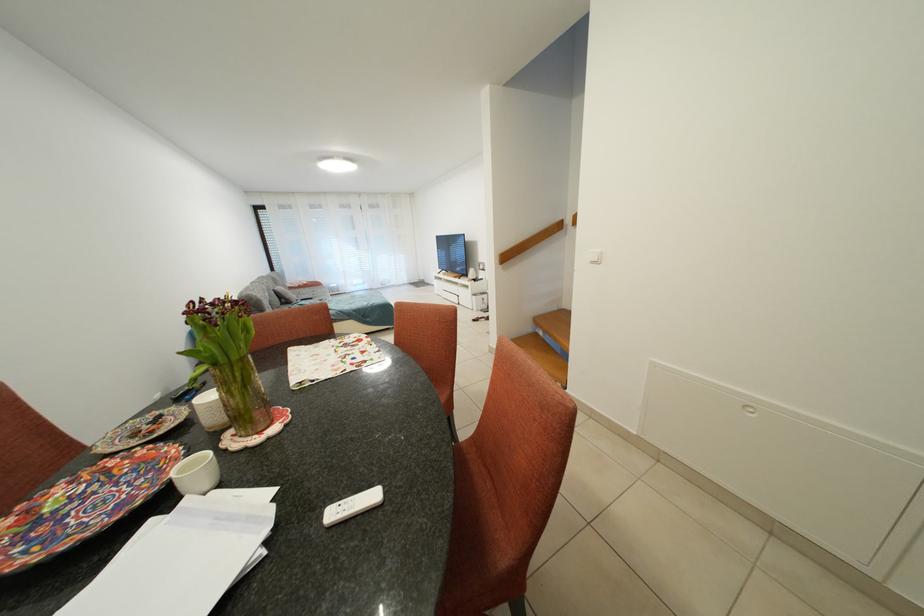
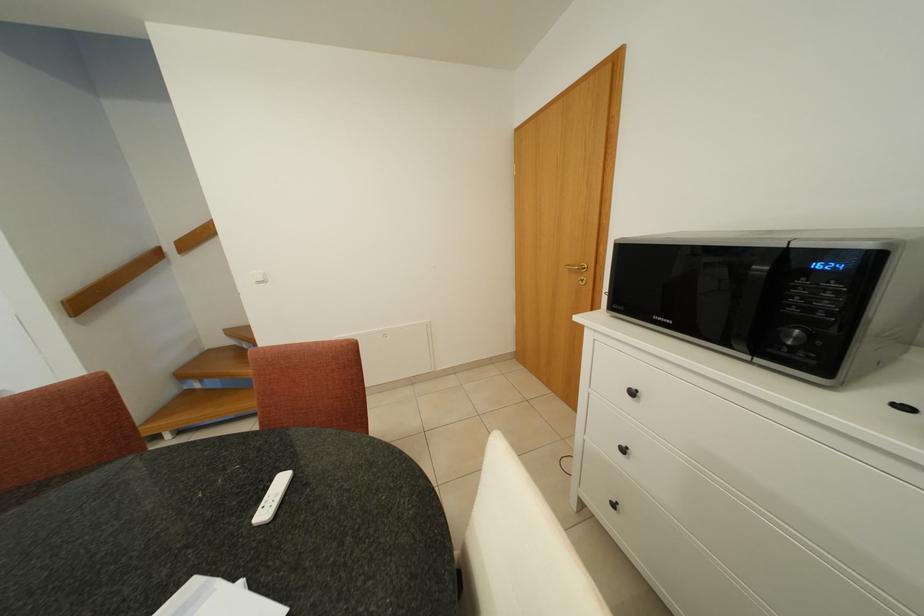
Question: The first image is from the beginning of the video and the second image is from the end. How did the camera likely rotate when shooting the video?

Choices:
 (A) Left
 (B) Right
 (C) Up
 (D) Down

Answer: (B)